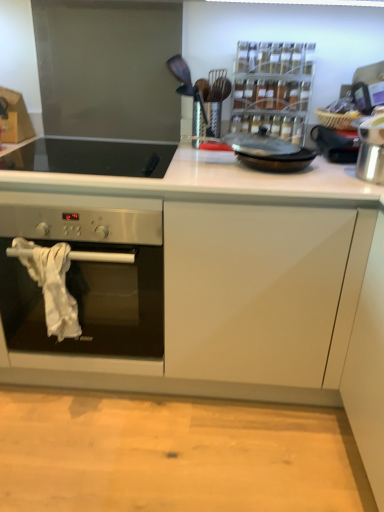
Question: Could you tell me if silver metallic pot at right, positioned as the 3th appliance in left-to-right order, is facing black glass cooktop at upper left?

Choices:
 (A) yes
 (B) no

Answer: (B)

Question: Considering the relative sizes of silver metallic pot at right, positioned as the 3th appliance in left-to-right order, and black glass cooktop at upper left in the image provided, is silver metallic pot at right, positioned as the 3th appliance in left-to-right order, shorter than black glass cooktop at upper left?

Choices:
 (A) no
 (B) yes

Answer: (A)

Question: Does silver metallic pot at right, marked as the 1th appliance in a right-to-left arrangement, have a smaller size compared to black glass cooktop at upper left?

Choices:
 (A) no
 (B) yes

Answer: (B)

Question: Is silver metallic pot at right, marked as the 1th appliance in a right-to-left arrangement, taller than black glass cooktop at upper left?

Choices:
 (A) no
 (B) yes

Answer: (B)

Question: Is silver metallic pot at right, marked as the 1th appliance in a right-to-left arrangement, bigger than black glass cooktop at upper left?

Choices:
 (A) no
 (B) yes

Answer: (A)

Question: In the image, is metallic silver ladle at upper center, placed as the first appliance when sorted from left to right, positioned in front of or behind silver metallic pot at right, positioned as the 3th appliance in left-to-right order?

Choices:
 (A) behind
 (B) front

Answer: (A)

Question: From the image's perspective, is metallic silver ladle at upper center, marked as the third appliance in a right-to-left arrangement, positioned above or below silver metallic pot at right, marked as the 1th appliance in a right-to-left arrangement?

Choices:
 (A) above
 (B) below

Answer: (A)

Question: Is metallic silver ladle at upper center, marked as the third appliance in a right-to-left arrangement, taller or shorter than silver metallic pot at right, marked as the 1th appliance in a right-to-left arrangement?

Choices:
 (A) tall
 (B) short

Answer: (A)

Question: Which is correct: metallic silver ladle at upper center, placed as the first appliance when sorted from left to right, is inside silver metallic pot at right, marked as the 1th appliance in a right-to-left arrangement, or outside of it?

Choices:
 (A) outside
 (B) inside

Answer: (A)

Question: Is black glass frying pan at center in front of or behind black glass cooktop at upper left in the image?

Choices:
 (A) front
 (B) behind

Answer: (B)

Question: Is black glass frying pan at center wider or thinner than black glass cooktop at upper left?

Choices:
 (A) wide
 (B) thin

Answer: (B)

Question: From a real-world perspective, is black glass frying pan at center above or below black glass cooktop at upper left?

Choices:
 (A) below
 (B) above

Answer: (B)

Question: In terms of size, does black glass frying pan at center appear bigger or smaller than black glass cooktop at upper left?

Choices:
 (A) big
 (B) small

Answer: (B)

Question: Looking at their shapes, would you say clear plastic spice rack at upper center, which is the 2th appliance from right to left, is wider or thinner than silver metallic pot at right, positioned as the 3th appliance in left-to-right order?

Choices:
 (A) wide
 (B) thin

Answer: (B)

Question: Visually, is clear plastic spice rack at upper center, which is counted as the 2th appliance, starting from the left, positioned to the left or to the right of silver metallic pot at right, marked as the 1th appliance in a right-to-left arrangement?

Choices:
 (A) left
 (B) right

Answer: (A)